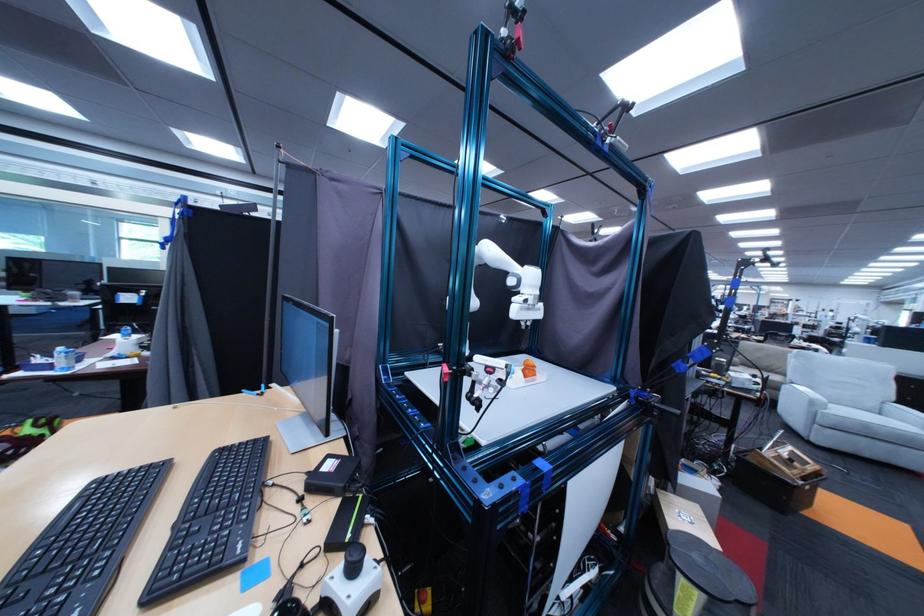
At what (x,y) coordinates should I click in order to perform the action: click on yellow emergency button. Please return your answer as a coordinate pair (x, y). This screenshot has height=616, width=924. Looking at the image, I should click on (422, 601).